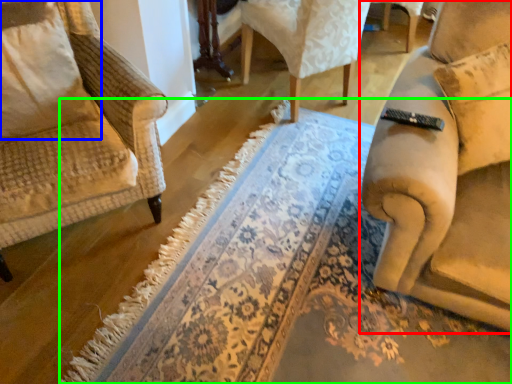
Question: Which object is the closest to the chair (highlighted by a red box)? Choose among these: pillow (highlighted by a blue box) or doormat (highlighted by a green box).

Choices:
 (A) pillow
 (B) doormat

Answer: (B)